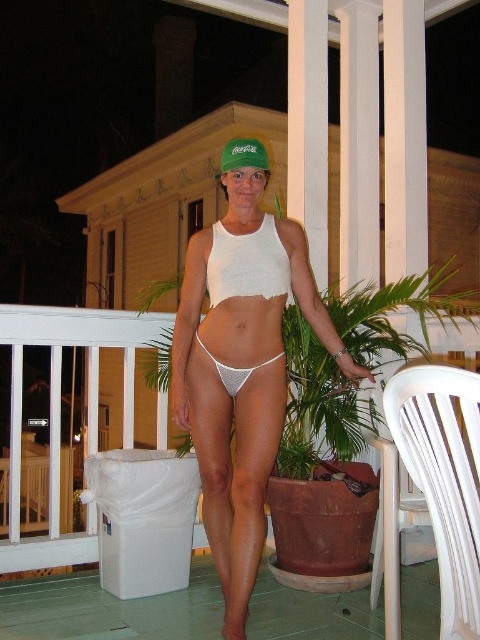
You are a photographer setting up a shot on the porch. You have a white plastic chair at lower right and a green fabric cap at center. Which object is taller?

The white plastic chair at lower right is taller than the green fabric cap at center.

You are a photographer setting up for a photoshoot on the porch. You have a white plastic chair at lower right and a white mesh bikini at center. Which object is taller?

The white plastic chair at lower right is taller than the white mesh bikini at center.

From the picture: You are a photographer setting up for a portrait. You want to place a small light source 3 meters away from the camera to evenly illuminate the scene. Is the white plastic chair at lower right within the required distance?

The white plastic chair at lower right is 2.70 meters away from the camera, which is within the 3 meters requirement. Therefore, placing the light source there would meet the distance criteria.